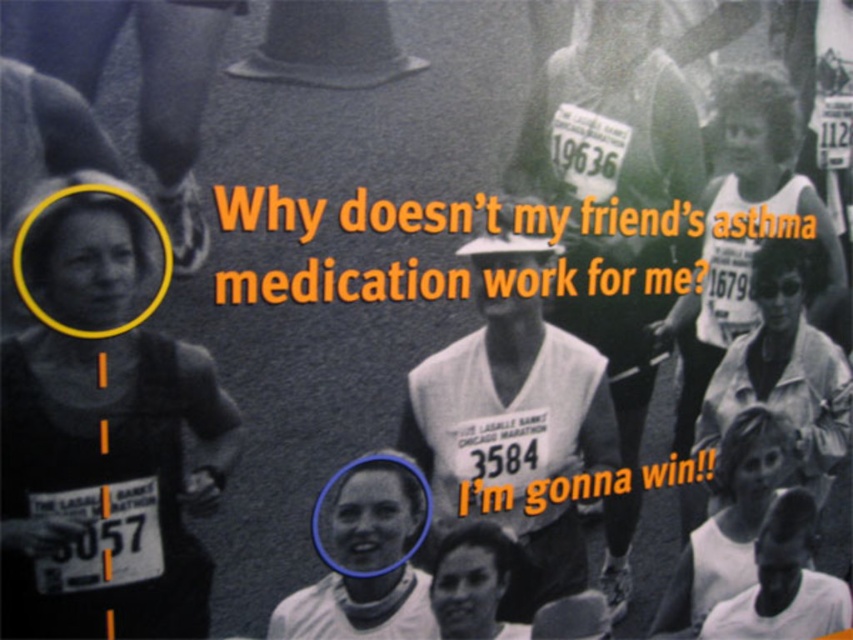
Question: Can you confirm if matte black shirt at left is thinner than white matte tank top at lower right?

Choices:
 (A) no
 (B) yes

Answer: (B)

Question: Considering the relative positions of matte black shirt at left and smooth white tank top at center in the image provided, where is matte black shirt at left located with respect to smooth white tank top at center?

Choices:
 (A) above
 (B) below

Answer: (A)

Question: Which point is farther from the camera taking this photo?

Choices:
 (A) (755, 570)
 (B) (363, 609)

Answer: (A)

Question: Which point appears closest to the camera in this image?

Choices:
 (A) (21, 397)
 (B) (677, 637)
 (C) (419, 616)

Answer: (A)

Question: Which of these objects is positioned closest to the white matte tank top at lower right?

Choices:
 (A) matte black shirt at left
 (B) smooth white tank top at center

Answer: (B)

Question: Where is white matte tank top at lower right located in relation to smooth white tank top at center in the image?

Choices:
 (A) below
 (B) above

Answer: (A)